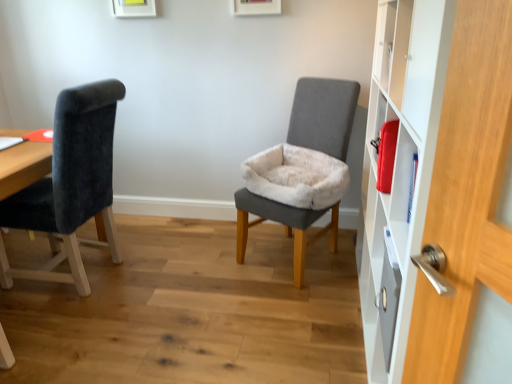
Locate an element on the screen. unoccupied area behind velvet black chair at left, marked as the first chair in a left-to-right arrangement is located at coordinates (143, 233).